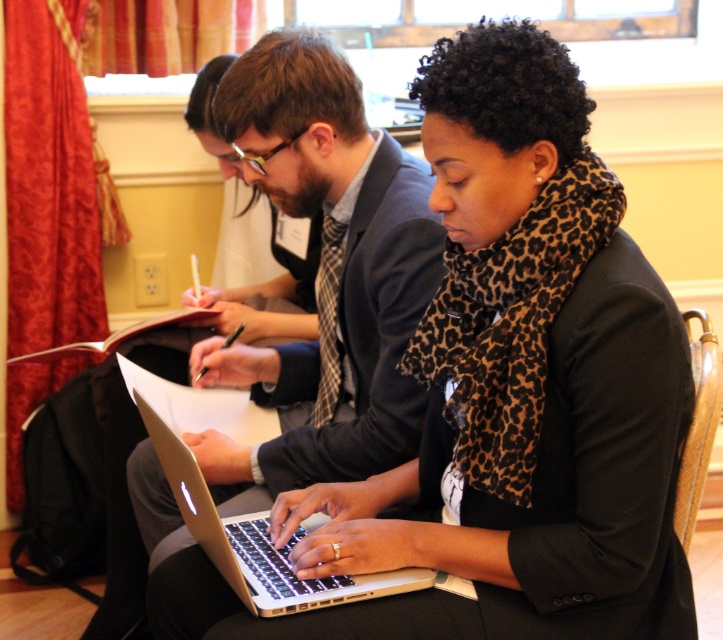
You are a photographer trying to capture a closeup of the two points in the image. Which point, point (570,445) or point (303,522), should you focus on to get a clearer image?

Point (570,445) is closer to the camera than point (303,522), so focusing on point (570,445) will result in a clearer image.

You are a delivery robot that is 0.8 meters wide. You are standing in the scene and want to deliver a package to the matte black laptop at center. Can you move directly to the laptop without any obstacles?

The distance between the matte black laptop at center and the viewer is 1.13 meters. Since the robot is 0.8 meters wide and there are no mentioned obstacles, the robot can move directly to the laptop.

You are trying to locate the matte black laptop at center in the image. According to the coordinates provided, where exactly is it positioned?

The matte black laptop at center is located at point coordinates of 0.617 on the x axis and 0.701 on the y axis.